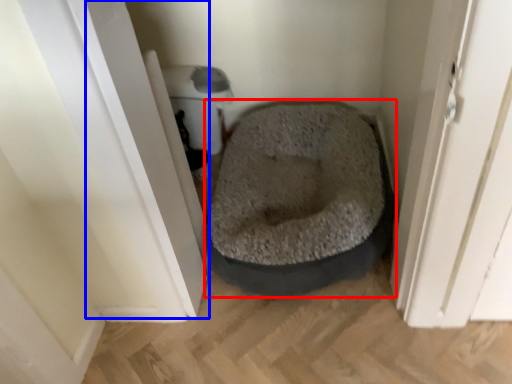
Question: Which of the following is the farthest to the observer, dog bed (highlighted by a red box) or screen door (highlighted by a blue box)?

Choices:
 (A) dog bed
 (B) screen door

Answer: (A)